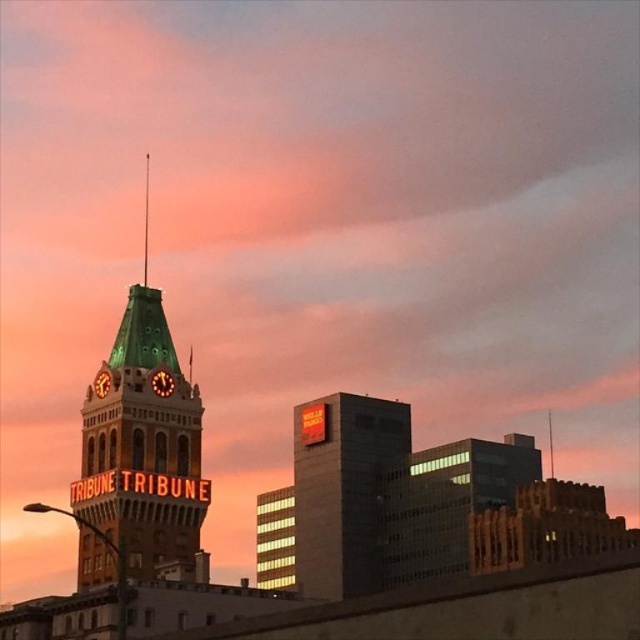
You are a city planner analyzing the skyline of this area. You notice two clock towers in the scene. Which one is taller between the green copper clock tower at upper left and the matte green clock tower at upper left?

The green copper clock tower at upper left is taller than the matte green clock tower at upper left according to the description.

You are a city planner reviewing the cityscape image. You need to determine which object at the center is bigger between the matte orange sign at center and the orange metallic clock at center. Which one is larger?

The matte orange sign at center has a larger size compared to the orange metallic clock at center, so the matte orange sign at center is bigger.